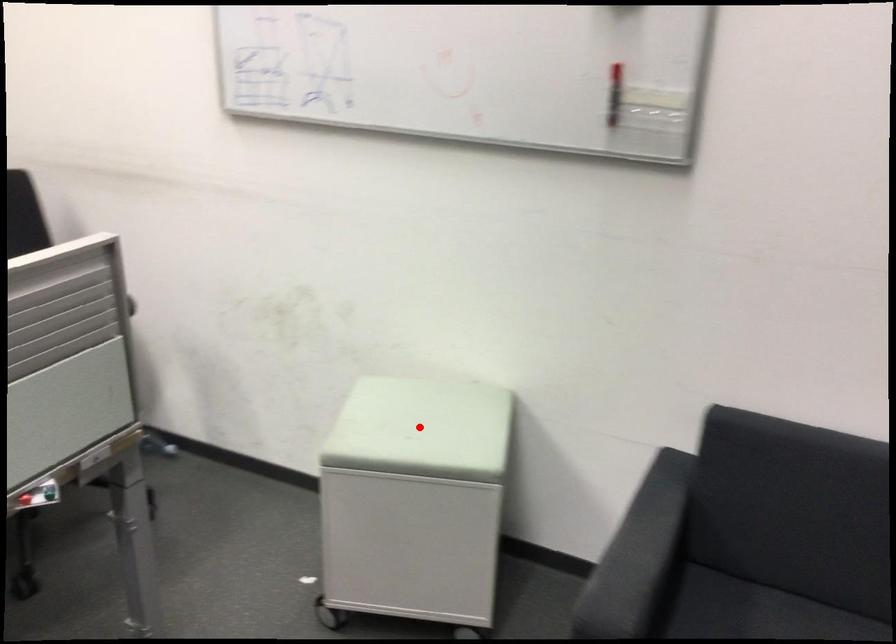
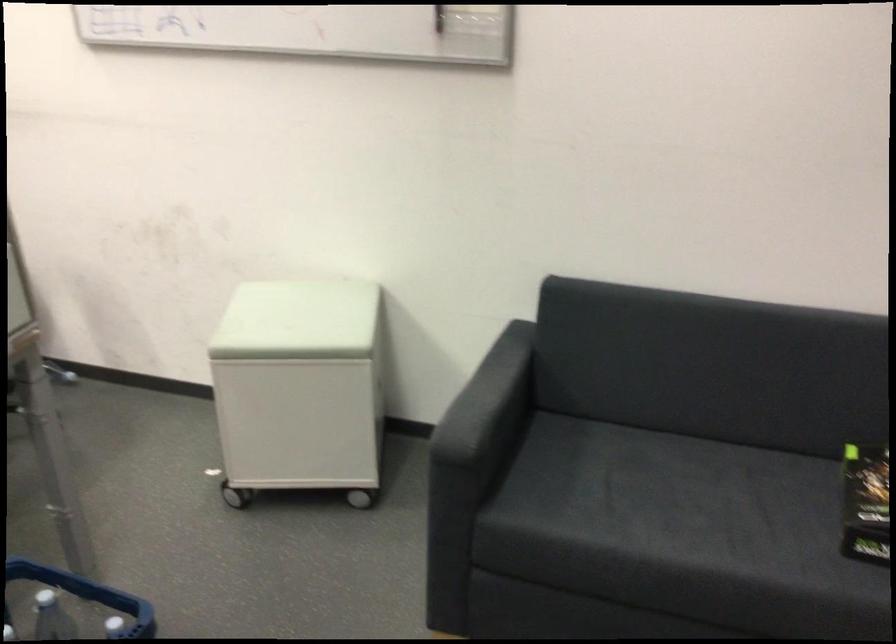
Question: A red point is marked in image1. In image2, is the corresponding 3D point closer to the camera or farther? Reply with the corresponding letter.

Choices:
 (A) The corresponding 3D point is closer.
 (B) The corresponding 3D point is farther.

Answer: (B)